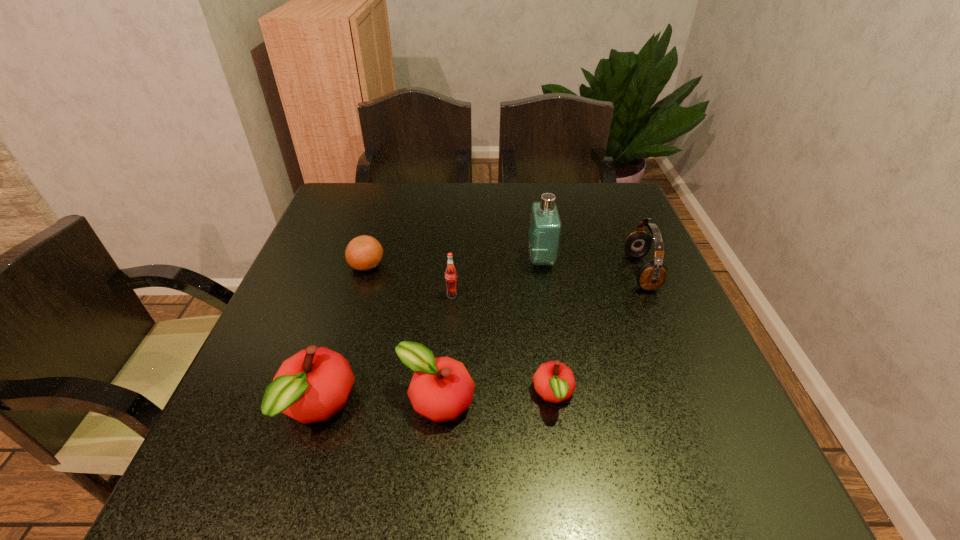
This screenshot has width=960, height=540. I want to click on the leftmost apple, so click(x=311, y=386).

Locate an element on the screen. The height and width of the screenshot is (540, 960). the second apple from left to right is located at coordinates (441, 389).

Identify the location of the third shortest object. (441, 389).

Identify the location of the shortest apple. (554, 382).

Identify the location of the tallest object. The image size is (960, 540). (545, 227).

You are a GUI agent. You are given a task and a screenshot of the screen. Output one action in this format:
    pyautogui.click(x=<x>, y=<y>)
    Task: Click on the soda bottle
    
    Given the screenshot: What is the action you would take?
    pyautogui.click(x=451, y=276)

Where is `clementine`? The width and height of the screenshot is (960, 540). clementine is located at coordinates (363, 253).

Where is `the rightmost object`? The image size is (960, 540). the rightmost object is located at coordinates pos(652,275).

Where is `vacant region located on the back of the leftmost apple`? vacant region located on the back of the leftmost apple is located at coordinates (345, 320).

You are a GUI agent. You are given a task and a screenshot of the screen. Output one action in this format:
    pyautogui.click(x=<x>, y=<y>)
    Task: Click on the vacant space positioned 0.400m on the back of the fifth tallest object
    The image size is (960, 540).
    Given the screenshot: What is the action you would take?
    pyautogui.click(x=449, y=249)